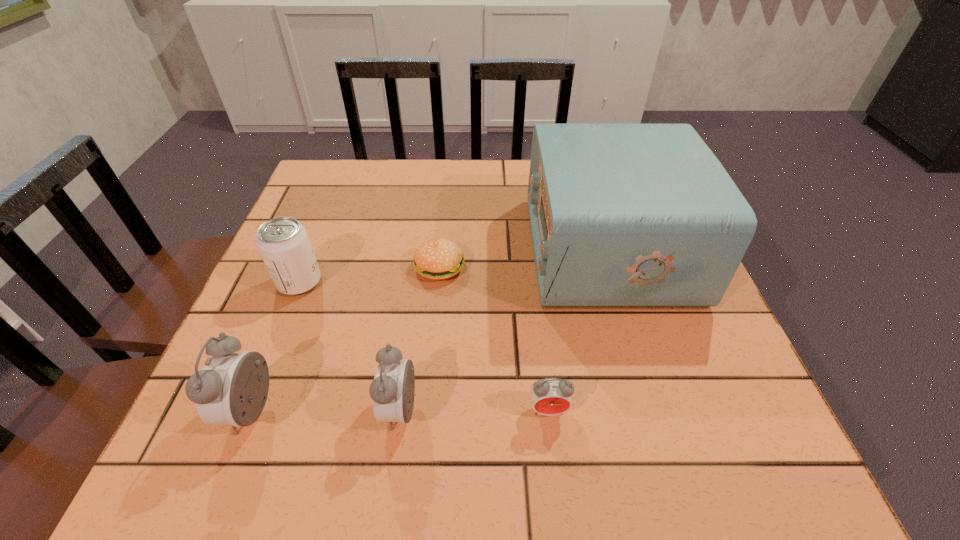
Please point a spot on the right to add another alarm clock. Please provide its 2D coordinates. Your answer should be formatted as a tuple, i.e. [(x, y)], where the tuple contains the x and y coordinates of a point satisfying the conditions above.

[(696, 409)]